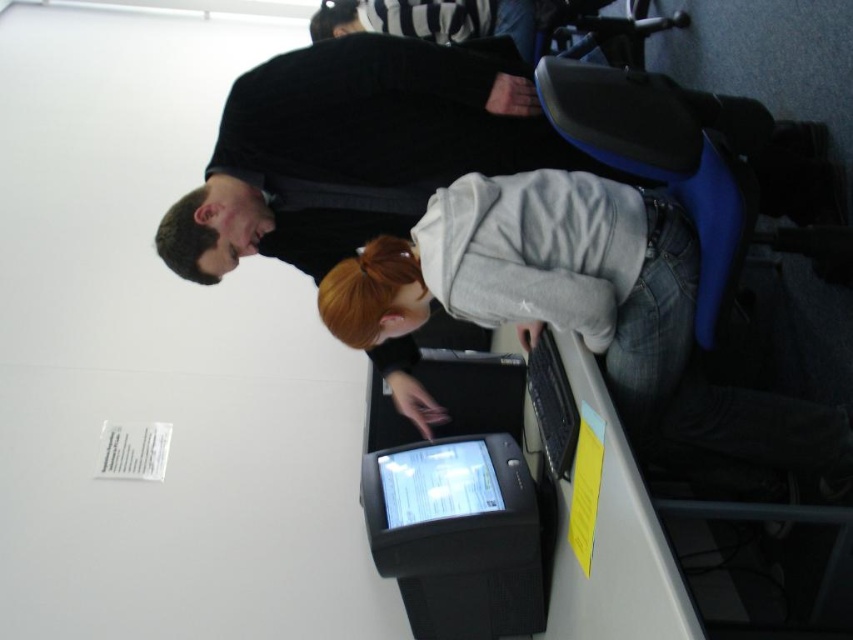
Who is positioned more to the right, gray fleece hoodie at center or black glossy monitor at center?

Positioned to the right is gray fleece hoodie at center.

Describe the element at coordinates (582, 307) in the screenshot. The image size is (853, 640). I see `gray fleece hoodie at center` at that location.

Identify the location of gray fleece hoodie at center. The image size is (853, 640). (582, 307).

Is black glossy tablet at center above striped fabric shirt at upper center?

No, black glossy tablet at center is not above striped fabric shirt at upper center.

Is point (485, 372) closer to camera compared to point (335, 13)?

Yes, point (485, 372) is in front of point (335, 13).

Does point (410, 429) lie behind point (321, 38)?

That is False.

The width and height of the screenshot is (853, 640). In order to click on black glossy tablet at center in this screenshot , I will do `click(473, 390)`.

Who is higher up, black glossy monitor at center or matte black monitor at center?

matte black monitor at center

Which is behind, point (529, 524) or point (467, 502)?

The point (467, 502) is more distant.

At what (x,y) coordinates should I click in order to perform the action: click on black glossy monitor at center. Please return your answer as a coordinate pair (x, y). Looking at the image, I should click on (450, 506).